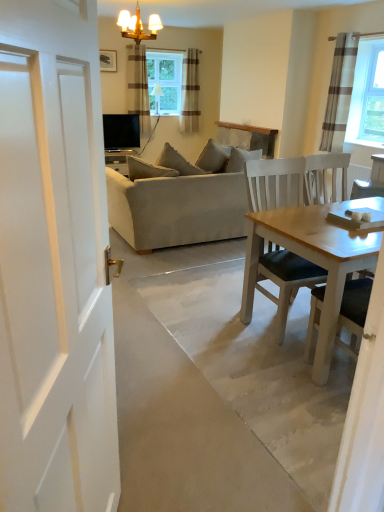
Question: Considering the relative sizes of gold metallic chandelier at upper center and sheer brown striped curtain at upper center, placed as the 1th curtain when sorted from left to right, in the image provided, is gold metallic chandelier at upper center bigger than sheer brown striped curtain at upper center, placed as the 1th curtain when sorted from left to right,?

Choices:
 (A) yes
 (B) no

Answer: (B)

Question: From the image's perspective, is gold metallic chandelier at upper center below sheer brown striped curtain at upper center, placed as the second curtain when sorted from back to front?

Choices:
 (A) no
 (B) yes

Answer: (B)

Question: Is gold metallic chandelier at upper center closer to the viewer compared to sheer brown striped curtain at upper center, placed as the 1th curtain when sorted from left to right?

Choices:
 (A) no
 (B) yes

Answer: (B)

Question: Is gold metallic chandelier at upper center facing towards sheer brown striped curtain at upper center, acting as the third curtain starting from the right?

Choices:
 (A) no
 (B) yes

Answer: (A)

Question: From a real-world perspective, is gold metallic chandelier at upper center on sheer brown striped curtain at upper center, acting as the third curtain starting from the right?

Choices:
 (A) no
 (B) yes

Answer: (B)

Question: Relative to beige fabric couch at center, is sheer brown striped curtain at upper center, placed as the 1th curtain when sorted from left to right, in front or behind?

Choices:
 (A) front
 (B) behind

Answer: (B)

Question: From a real-world perspective, is sheer brown striped curtain at upper center, which appears as the second curtain when viewed from the front, positioned above or below beige fabric couch at center?

Choices:
 (A) below
 (B) above

Answer: (B)

Question: Considering the positions of sheer brown striped curtain at upper center, acting as the third curtain starting from the right, and beige fabric couch at center in the image, is sheer brown striped curtain at upper center, acting as the third curtain starting from the right, taller or shorter than beige fabric couch at center?

Choices:
 (A) short
 (B) tall

Answer: (B)

Question: Looking at the image, does sheer brown striped curtain at upper center, which appears as the second curtain when viewed from the front, seem bigger or smaller compared to beige fabric couch at center?

Choices:
 (A) small
 (B) big

Answer: (A)

Question: In terms of size, does beige striped curtain at upper center, arranged as the 2th curtain when viewed from the right, appear bigger or smaller than gold metallic chandelier at upper center?

Choices:
 (A) big
 (B) small

Answer: (B)

Question: From a real-world perspective, is beige striped curtain at upper center, arranged as the 2th curtain when viewed from the right, above or below gold metallic chandelier at upper center?

Choices:
 (A) below
 (B) above

Answer: (A)

Question: In the image, is beige striped curtain at upper center, arranged as the second curtain when viewed from the left, positioned in front of or behind gold metallic chandelier at upper center?

Choices:
 (A) behind
 (B) front

Answer: (A)

Question: Would you say beige striped curtain at upper center, the first curtain from the back, is to the left or to the right of gold metallic chandelier at upper center in the picture?

Choices:
 (A) left
 (B) right

Answer: (B)

Question: From a real-world perspective, is gray striped curtain at upper right, acting as the 1th curtain starting from the front, above or below clear glass window at upper center?

Choices:
 (A) below
 (B) above

Answer: (A)

Question: Based on their positions, is gray striped curtain at upper right, acting as the 1th curtain starting from the front, located to the left or right of clear glass window at upper center?

Choices:
 (A) left
 (B) right

Answer: (B)